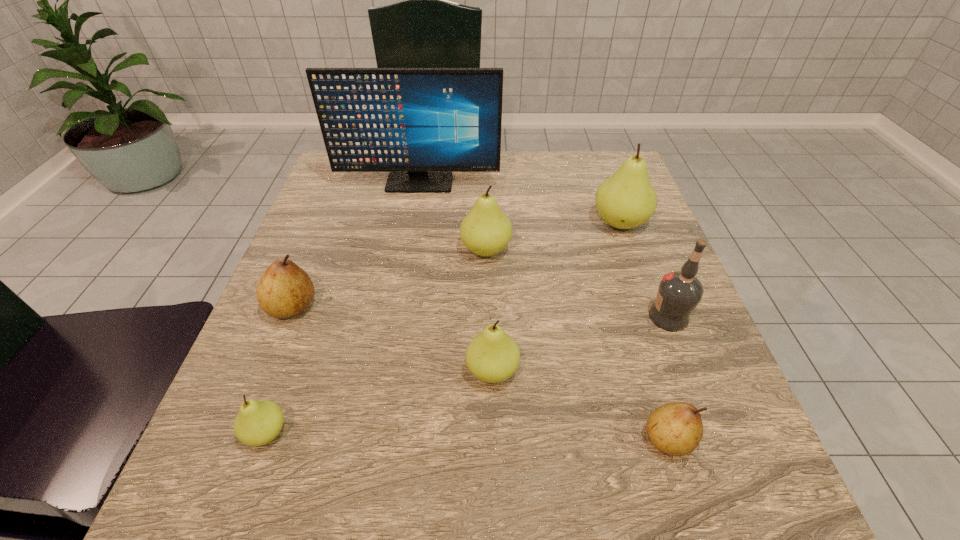
In order to click on vacant space that is in between the biggest green pear and the vodka in this screenshot , I will do click(x=644, y=270).

At what (x,y) coordinates should I click in order to perform the action: click on free space between the second biggest green pear and the tallest object. Please return your answer as a coordinate pair (x, y). This screenshot has width=960, height=540. Looking at the image, I should click on (452, 217).

Locate an element on the screen. The image size is (960, 540). free area in between the second biggest green pear and the nearest green pear is located at coordinates (376, 341).

Find the location of a particular element. unoccupied position between the third biggest green pear and the right brown pear is located at coordinates (580, 405).

Where is `empty space between the second nearest green pear and the tallest pear`? The height and width of the screenshot is (540, 960). empty space between the second nearest green pear and the tallest pear is located at coordinates (556, 297).

Where is `blank region between the farther brown pear and the biggest green pear`? blank region between the farther brown pear and the biggest green pear is located at coordinates (456, 265).

Identify which object is the sixth nearest to the black computer monitor. Please provide its 2D coordinates. Your answer should be formatted as a tuple, i.e. [(x, y)], where the tuple contains the x and y coordinates of a point satisfying the conditions above.

[(258, 422)]

The height and width of the screenshot is (540, 960). Find the location of `object that ranks as the sixth closest to the second tallest pear`. object that ranks as the sixth closest to the second tallest pear is located at coordinates (676, 428).

Choose which pear is the nearest neighbor to the rightmost green pear. Please provide its 2D coordinates. Your answer should be formatted as a tuple, i.e. [(x, y)], where the tuple contains the x and y coordinates of a point satisfying the conditions above.

[(485, 231)]

Find the location of `pear that is the fourth closest one to the biggest green pear`. pear that is the fourth closest one to the biggest green pear is located at coordinates (285, 290).